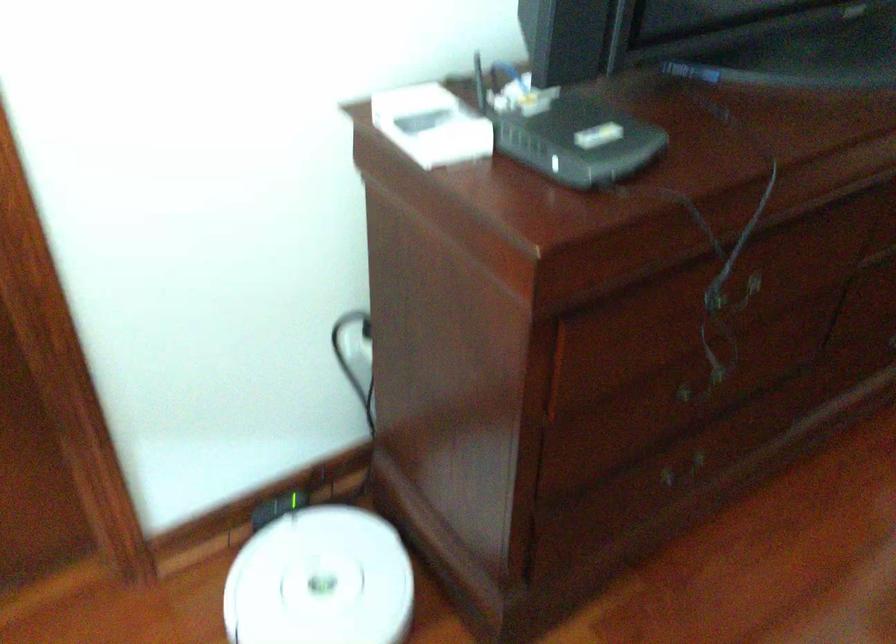
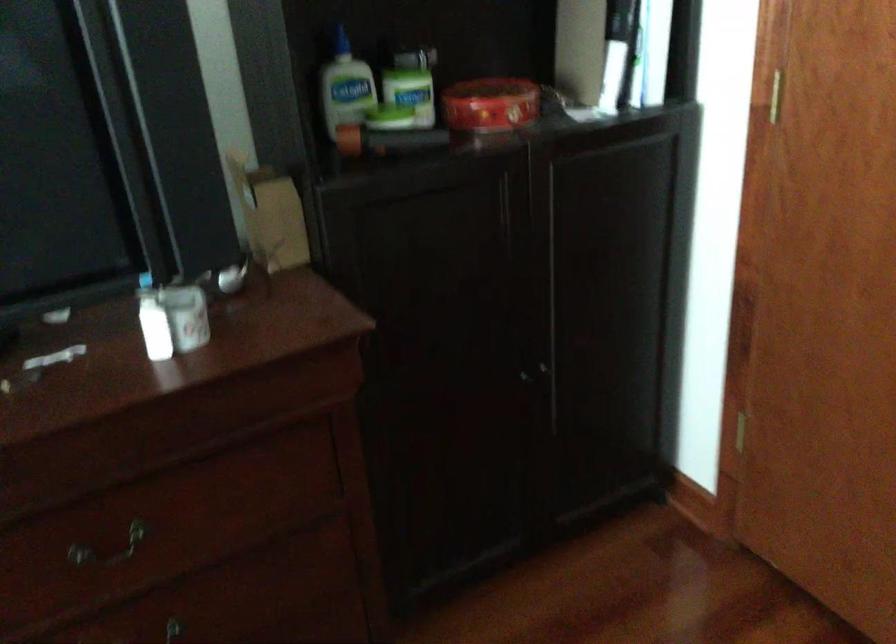
Question: The images are taken continuously from a first-person perspective. In which direction are you moving?

Choices:
 (A) Left
 (B) Right
 (C) Forward
 (D) Backward

Answer: (B)